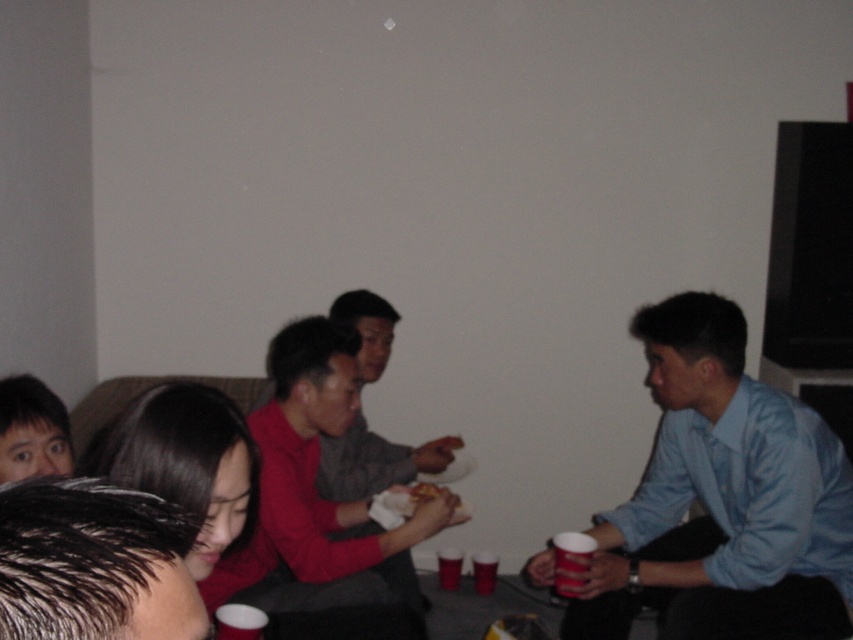
Can you confirm if matte plastic cup at lower right is positioned above golden crispy chicken at center?

Incorrect, matte plastic cup at lower right is not positioned above golden crispy chicken at center.

This screenshot has height=640, width=853. What do you see at coordinates (570, 561) in the screenshot?
I see `matte plastic cup at lower right` at bounding box center [570, 561].

You are a GUI agent. You are given a task and a screenshot of the screen. Output one action in this format:
    pyautogui.click(x=<x>, y=<y>)
    Task: Click on the matte plastic cup at lower right
    The width and height of the screenshot is (853, 640).
    Given the screenshot: What is the action you would take?
    pyautogui.click(x=570, y=561)

Is smooth black hair at lower left positioned behind matte plastic cup at lower right?

No, it is in front of matte plastic cup at lower right.

Is smooth black hair at lower left thinner than matte plastic cup at lower right?

No.

The image size is (853, 640). In order to click on smooth black hair at lower left in this screenshot , I will do `click(32, 429)`.

Find the location of a particular element. This screenshot has width=853, height=640. red matte shirt at center is located at coordinates (320, 506).

In the scene shown: Is red matte shirt at center bigger than golden crispy chicken at center?

Yes, red matte shirt at center is bigger than golden crispy chicken at center.

Between point (323, 317) and point (428, 500), which one is positioned behind?

The point (323, 317) is behind.

The image size is (853, 640). I want to click on red matte shirt at center, so click(x=320, y=506).